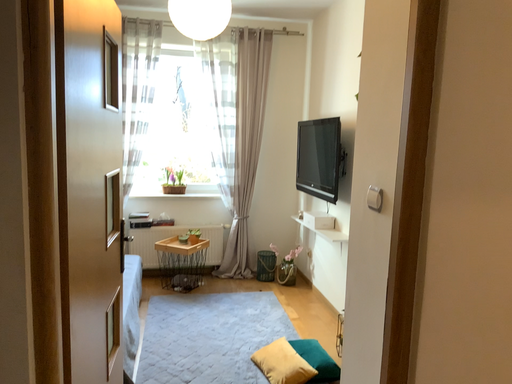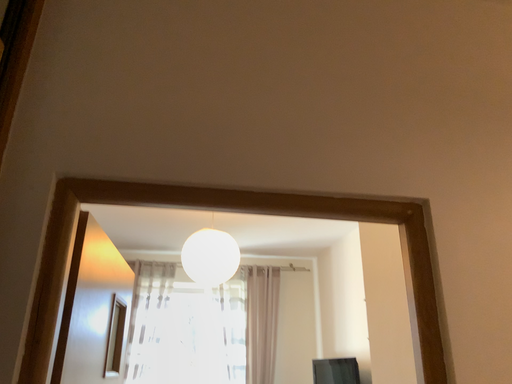
Question: How did the camera likely rotate when shooting the video?

Choices:
 (A) rotated upward
 (B) rotated downward

Answer: (A)